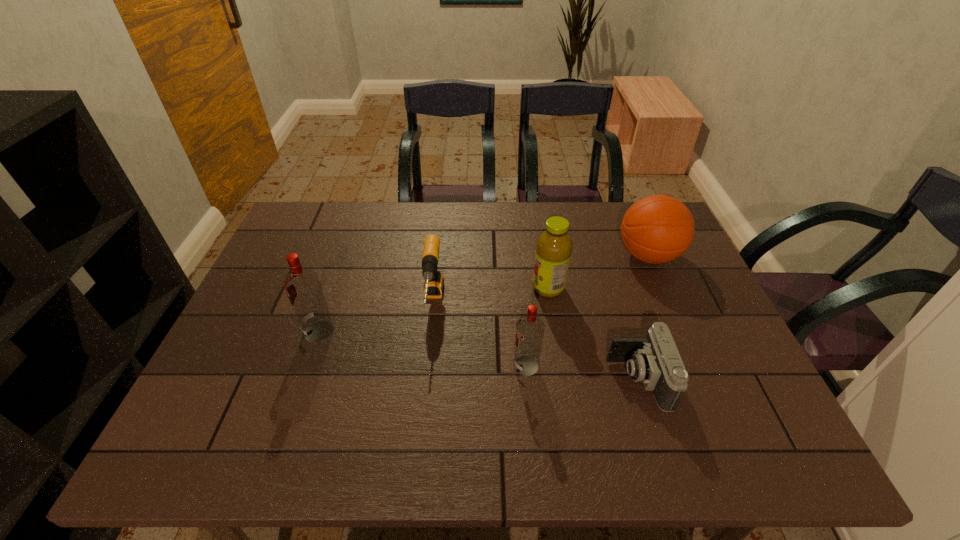
This screenshot has height=540, width=960. In order to click on free space between the taller vodka and the basketball in this screenshot , I will do `click(484, 293)`.

I want to click on the third closest object relative to the nearer vodka, so click(434, 282).

Find the location of a particular element. The width and height of the screenshot is (960, 540). the second closest object to the fifth tallest object is located at coordinates (302, 286).

The width and height of the screenshot is (960, 540). In order to click on free space that satisfies the following two spatial constraints: 1. on the front label of the fourth object from left to right; 2. on the handle side of the drill in this screenshot , I will do `click(551, 303)`.